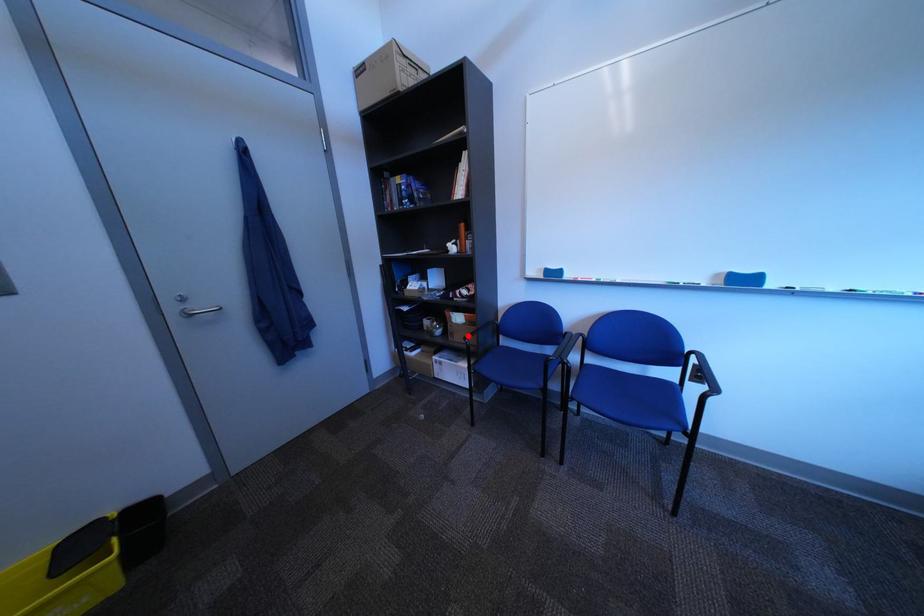
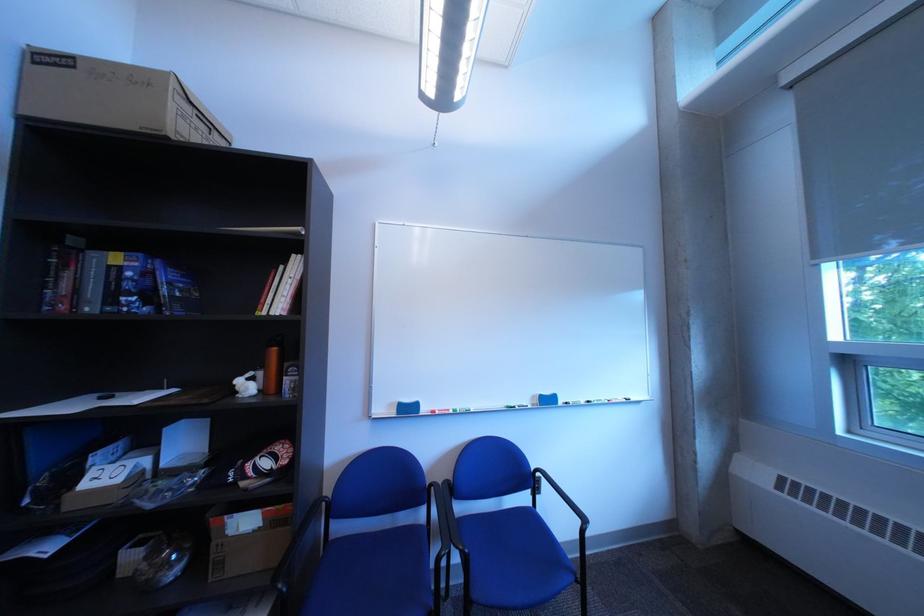
In the second image, find the point that corresponds to the highlighted location in the first image.

(237, 565)